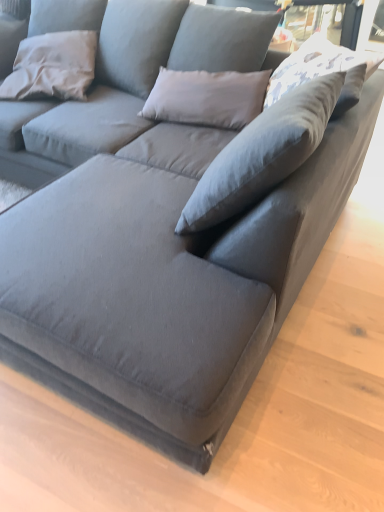
Question: Can you confirm if gray fabric pillow at upper left, which appears as the 2th pillow when viewed from the front, is thinner than white printed fabric pillow at upper right, which is the first pillow in right-to-left order?

Choices:
 (A) yes
 (B) no

Answer: (A)

Question: From the image's perspective, is gray fabric pillow at upper left, which is the second pillow in right-to-left order, under white printed fabric pillow at upper right, the second pillow when ordered from back to front?

Choices:
 (A) no
 (B) yes

Answer: (A)

Question: Is the surface of gray fabric pillow at upper left, placed as the first pillow when sorted from left to right, in direct contact with white printed fabric pillow at upper right, the second pillow viewed from the left?

Choices:
 (A) yes
 (B) no

Answer: (B)

Question: Considering the relative sizes of gray fabric pillow at upper left, which is the second pillow in right-to-left order, and white printed fabric pillow at upper right, the second pillow when ordered from back to front, in the image provided, is gray fabric pillow at upper left, which is the second pillow in right-to-left order, wider than white printed fabric pillow at upper right, the second pillow when ordered from back to front,?

Choices:
 (A) no
 (B) yes

Answer: (A)

Question: Can you confirm if gray fabric pillow at upper left, which appears as the 2th pillow when viewed from the front, is shorter than white printed fabric pillow at upper right, which is the first pillow in front-to-back order?

Choices:
 (A) no
 (B) yes

Answer: (A)

Question: Is gray fabric pillow at upper left, placed as the first pillow when sorted from left to right, at the left side of white printed fabric pillow at upper right, which is the first pillow in front-to-back order?

Choices:
 (A) yes
 (B) no

Answer: (A)

Question: Does white printed fabric pillow at upper right, which is the first pillow in right-to-left order, have a lesser height compared to gray fabric pillow at upper left, placed as the first pillow when sorted from left to right?

Choices:
 (A) yes
 (B) no

Answer: (A)

Question: Is white printed fabric pillow at upper right, the second pillow when ordered from back to front, positioned with its back to gray fabric pillow at upper left, which is the second pillow in right-to-left order?

Choices:
 (A) no
 (B) yes

Answer: (A)

Question: Does white printed fabric pillow at upper right, the second pillow when ordered from back to front, lie in front of gray fabric pillow at upper left, placed as the first pillow when sorted from left to right?

Choices:
 (A) yes
 (B) no

Answer: (A)

Question: From the image's perspective, would you say white printed fabric pillow at upper right, the second pillow viewed from the left, is positioned over gray fabric pillow at upper left, the first pillow from the back?

Choices:
 (A) yes
 (B) no

Answer: (B)

Question: Could gray fabric pillow at upper left, placed as the first pillow when sorted from left to right, be considered to be inside white printed fabric pillow at upper right, the second pillow when ordered from back to front?

Choices:
 (A) yes
 (B) no

Answer: (B)

Question: Is white printed fabric pillow at upper right, which is the first pillow in front-to-back order, not within gray fabric pillow at upper left, which appears as the 2th pillow when viewed from the front?

Choices:
 (A) no
 (B) yes

Answer: (B)

Question: Do you think gray fabric pillow at upper left, the first pillow from the back, is within white printed fabric pillow at upper right, the second pillow viewed from the left, or outside of it?

Choices:
 (A) outside
 (B) inside

Answer: (A)